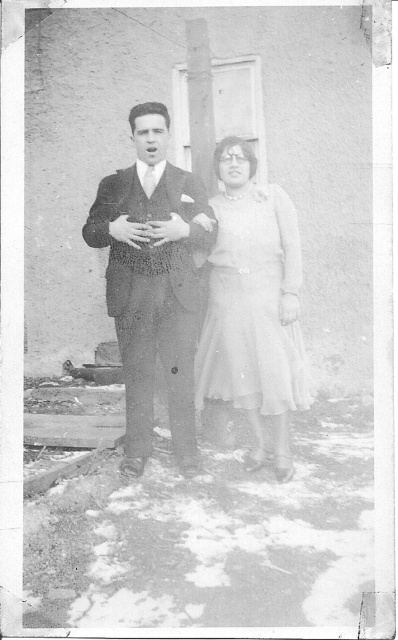
What do you see at coordinates (152, 282) in the screenshot? This screenshot has height=640, width=398. I see `smooth dark suit at center` at bounding box center [152, 282].

Who is taller, smooth dark suit at center or white sheer dress at center?

smooth dark suit at center

This screenshot has width=398, height=640. In order to click on smooth dark suit at center in this screenshot , I will do `click(152, 282)`.